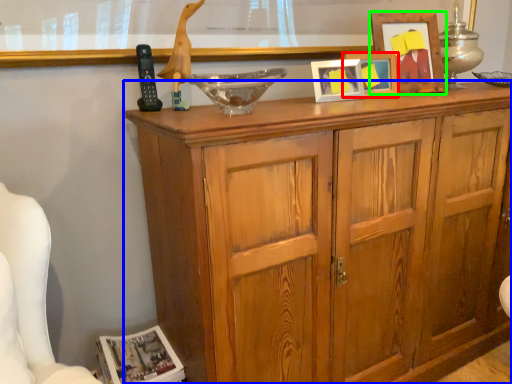
Question: Considering the real-world distances, which object is closest to picture frame (highlighted by a red box)? cabinetry (highlighted by a blue box) or picture frame (highlighted by a green box).

Choices:
 (A) cabinetry
 (B) picture frame

Answer: (B)